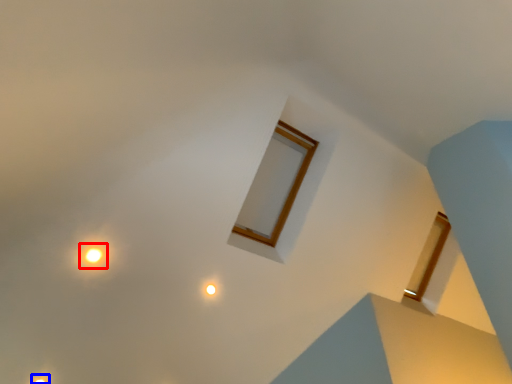
Question: Which of the following is the closest to the observer, light (highlighted by a red box) or light (highlighted by a blue box)?

Choices:
 (A) light
 (B) light

Answer: (A)